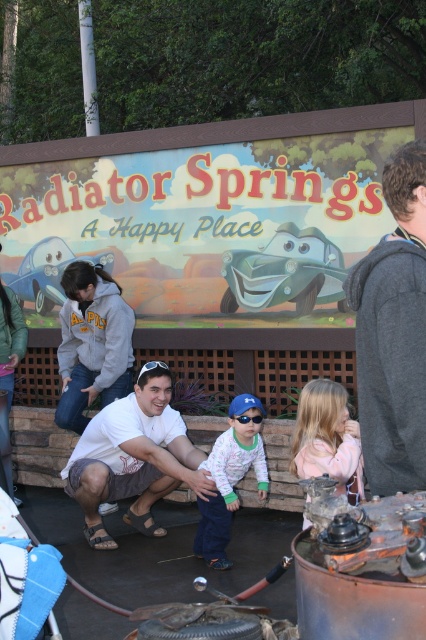
Who is taller, dark gray sweater at upper right or white fleece jacket at center?

dark gray sweater at upper right is taller.

Which is in front, point (365, 349) or point (244, 413)?

Positioned in front is point (365, 349).

Looking at this image, who is more forward, (417, 314) or (259, 496)?

Point (417, 314)

Identify the location of dark gray sweater at upper right. (394, 332).

Is dark gray sweater at upper right taller than white matte shirt at center?

Incorrect, dark gray sweater at upper right's height is not larger of white matte shirt at center's.

Between point (354, 278) and point (135, 390), which one is positioned in front?

Point (354, 278) is more forward.

The image size is (426, 640). What are the coordinates of `dark gray sweater at upper right` in the screenshot? It's located at (394, 332).

How distant is white matte shirt at center from white fleece jacket at center?

The distance of white matte shirt at center from white fleece jacket at center is 21.78 inches.

Which of these two, white matte shirt at center or white fleece jacket at center, stands shorter?

white fleece jacket at center is shorter.

Is point (114, 420) in front of point (233, 442)?

No, it is not.

This screenshot has width=426, height=640. Identify the location of white matte shirt at center. click(x=134, y=458).